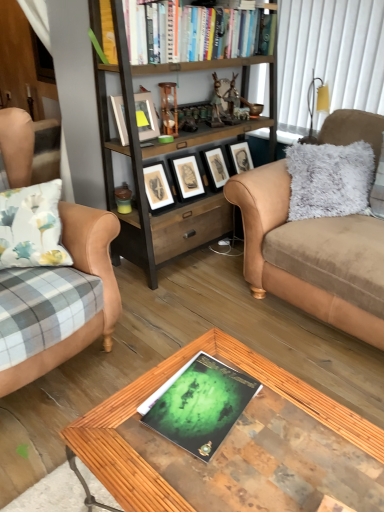
You are a GUI agent. You are given a task and a screenshot of the screen. Output one action in this format:
    pyautogui.click(x=<x>, y=<y>)
    Task: Click on the suede couch at right, acting as the first studio couch starting from the right
    This screenshot has height=512, width=384.
    Given the screenshot: What is the action you would take?
    pyautogui.click(x=311, y=255)

Locate an element on the screen. The height and width of the screenshot is (512, 384). green matte magazine at center is located at coordinates (199, 404).

Describe the element at coordinates (199, 404) in the screenshot. I see `green matte magazine at center` at that location.

Describe the element at coordinates (85, 272) in the screenshot. I see `tan leather couch at left, acting as the 2th studio couch starting from the right` at that location.

At what (x,y) coordinates should I click in order to perform the action: click on wooden glass coffee table at center. Please return your answer as a coordinate pair (x, y). The width and height of the screenshot is (384, 512). Looking at the image, I should click on (235, 446).

What is the approximate width of matte wooden picture frame at upper center, which ranks as the 2th picture frame in right-to-left order?

matte wooden picture frame at upper center, which ranks as the 2th picture frame in right-to-left order, is 3.93 inches wide.

The width and height of the screenshot is (384, 512). Describe the element at coordinates (166, 155) in the screenshot. I see `woodenmaterial/texture bookcase at center` at that location.

In order to click on suede couch at right, acting as the first studio couch starting from the right in this screenshot , I will do `click(311, 255)`.

Is woodenmaterial/texture bookcase at center outside of hardcover books at upper center?

Indeed, woodenmaterial/texture bookcase at center is completely outside hardcover books at upper center.

Between woodenmaterial/texture bookcase at center and hardcover books at upper center, which one has larger size?

woodenmaterial/texture bookcase at center.

Based on the photo, measure the distance between woodenmaterial/texture bookcase at center and hardcover books at upper center.

A distance of 14.29 inches exists between woodenmaterial/texture bookcase at center and hardcover books at upper center.

How many degrees apart are the facing directions of woodenmaterial/texture bookcase at center and hardcover books at upper center?

The angular difference between woodenmaterial/texture bookcase at center and hardcover books at upper center is 0.709 degrees.

Is suede couch at right, acting as the first studio couch starting from the right, oriented towards matte wooden picture frame at upper center, the first picture frame in the left-to-right sequence?

No, suede couch at right, acting as the first studio couch starting from the right, is not turned towards matte wooden picture frame at upper center, the first picture frame in the left-to-right sequence.

Does point (357, 333) appear closer or farther from the camera than point (145, 116)?

Point (357, 333) is closer to the camera than point (145, 116).

From a real-world perspective, is suede couch at right, which appears as the second studio couch when viewed from the left, physically located above or below matte wooden picture frame at upper center, arranged as the first picture frame when viewed from the front?

Clearly, from a real-world perspective, suede couch at right, which appears as the second studio couch when viewed from the left, is below matte wooden picture frame at upper center, arranged as the first picture frame when viewed from the front.

From the image's perspective, does suede couch at right, acting as the first studio couch starting from the right, appear lower than matte wooden picture frame at upper center, arranged as the second picture frame when viewed from the back?

Correct, suede couch at right, acting as the first studio couch starting from the right, appears lower than matte wooden picture frame at upper center, arranged as the second picture frame when viewed from the back, in the image.

Is point (141, 221) closer to camera compared to point (199, 179)?

Yes.

From the image's perspective, is woodenmaterial/texture bookcase at center on top of matte black picture frame at center, which appears as the 2th picture frame when viewed from the front?

Indeed, from the image's perspective, woodenmaterial/texture bookcase at center is shown above matte black picture frame at center, which appears as the 2th picture frame when viewed from the front.

Based on the photo, considering the sizes of objects woodenmaterial/texture bookcase at center and matte black picture frame at center, which appears as the 2th picture frame when viewed from the front, in the image provided, who is shorter, woodenmaterial/texture bookcase at center or matte black picture frame at center, which appears as the 2th picture frame when viewed from the front,?

matte black picture frame at center, which appears as the 2th picture frame when viewed from the front.

Can you tell me how much matte black picture frame at center, which ranks as the 1th picture frame in right-to-left order, and hardcover books at upper center differ in facing direction?

There is a 3.51-degree angle between the facing directions of matte black picture frame at center, which ranks as the 1th picture frame in right-to-left order, and hardcover books at upper center.

You are a GUI agent. You are given a task and a screenshot of the screen. Output one action in this format:
    pyautogui.click(x=<x>, y=<y>)
    Task: Click on the 2nd picture frame positioned below the hardcover books at upper center (from a real-world perspective)
    This screenshot has width=384, height=512.
    Given the screenshot: What is the action you would take?
    pyautogui.click(x=187, y=177)

From the image's perspective, is matte black picture frame at center, which ranks as the 1th picture frame in right-to-left order, under hardcover books at upper center?

Yes, from the image's perspective, matte black picture frame at center, which ranks as the 1th picture frame in right-to-left order, is beneath hardcover books at upper center.

Is green matte magazine at center taller than matte wooden picture frame at upper center, arranged as the first picture frame when viewed from the front?

No, green matte magazine at center is not taller than matte wooden picture frame at upper center, arranged as the first picture frame when viewed from the front.

The image size is (384, 512). In order to click on magazine that appears on the right of matte wooden picture frame at upper center, arranged as the second picture frame when viewed from the back in this screenshot , I will do (x=199, y=404).

Is green matte magazine at center outside of matte wooden picture frame at upper center, arranged as the first picture frame when viewed from the front?

Absolutely, green matte magazine at center is external to matte wooden picture frame at upper center, arranged as the first picture frame when viewed from the front.

Can you confirm if wooden glass coffee table at center is thinner than matte wooden picture frame at upper center, arranged as the first picture frame when viewed from the front?

Incorrect, the width of wooden glass coffee table at center is not less than that of matte wooden picture frame at upper center, arranged as the first picture frame when viewed from the front.

Who is shorter, wooden glass coffee table at center or matte wooden picture frame at upper center, which ranks as the 2th picture frame in right-to-left order?

matte wooden picture frame at upper center, which ranks as the 2th picture frame in right-to-left order, is shorter.

From a real-world perspective, does wooden glass coffee table at center stand above matte wooden picture frame at upper center, the first picture frame in the left-to-right sequence?

No, from a real-world perspective, wooden glass coffee table at center is not on top of matte wooden picture frame at upper center, the first picture frame in the left-to-right sequence.

Considering the relative sizes of tan leather couch at left, acting as the 2th studio couch starting from the right, and matte wooden picture frame at upper center, which ranks as the 2th picture frame in right-to-left order, in the image provided, is tan leather couch at left, acting as the 2th studio couch starting from the right, shorter than matte wooden picture frame at upper center, which ranks as the 2th picture frame in right-to-left order,?

Incorrect, the height of tan leather couch at left, acting as the 2th studio couch starting from the right, does not fall short of that of matte wooden picture frame at upper center, which ranks as the 2th picture frame in right-to-left order.

Is tan leather couch at left, which is counted as the 1th studio couch, starting from the left, to the left or to the right of matte wooden picture frame at upper center, the first picture frame in the left-to-right sequence, in the image?

tan leather couch at left, which is counted as the 1th studio couch, starting from the left, is to the left of matte wooden picture frame at upper center, the first picture frame in the left-to-right sequence.

Could you tell me if tan leather couch at left, acting as the 2th studio couch starting from the right, is facing matte wooden picture frame at upper center, arranged as the first picture frame when viewed from the front?

No.

This screenshot has height=512, width=384. Find the location of `book above the woodenmaterial/texture bookcase at center (from the image's perspective)`. book above the woodenmaterial/texture bookcase at center (from the image's perspective) is located at coordinates (210, 35).

From the image's perspective, starting from the matte wooden picture frame at upper center, arranged as the second picture frame when viewed from the back, which studio couch is the 1st one below? Please provide its 2D coordinates.

[(311, 255)]

Looking at the image, which one is located further to matte black picture frame at center, which ranks as the 1th picture frame in right-to-left order, woodenmaterial/texture bookcase at center or green matte magazine at center?

green matte magazine at center is positioned further to the anchor matte black picture frame at center, which ranks as the 1th picture frame in right-to-left order.

From the image, which object appears to be nearer to matte black picture frame at center, which appears as the 2th picture frame when viewed from the front, hardcover books at upper center or suede couch at right, which appears as the second studio couch when viewed from the left?

hardcover books at upper center is closer to matte black picture frame at center, which appears as the 2th picture frame when viewed from the front.

Based on their spatial positions, is wooden glass coffee table at center or tan leather couch at left, which is counted as the 1th studio couch, starting from the left, closer to suede couch at right, acting as the first studio couch starting from the right?

Based on the image, tan leather couch at left, which is counted as the 1th studio couch, starting from the left, appears to be nearer to suede couch at right, acting as the first studio couch starting from the right.

Looking at the image, which one is located closer to woodenmaterial/texture bookcase at center, green matte magazine at center or wooden glass coffee table at center?

wooden glass coffee table at center is closer to woodenmaterial/texture bookcase at center.

When comparing their distances from hardcover books at upper center, does woodenmaterial/texture bookcase at center or tan leather couch at left, acting as the 2th studio couch starting from the right, seem closer?

Based on the image, woodenmaterial/texture bookcase at center appears to be nearer to hardcover books at upper center.

From the image, which object appears to be nearer to suede couch at right, which appears as the second studio couch when viewed from the left, tan leather couch at left, which is counted as the 1th studio couch, starting from the left, or wooden glass coffee table at center?

Based on the image, tan leather couch at left, which is counted as the 1th studio couch, starting from the left, appears to be nearer to suede couch at right, which appears as the second studio couch when viewed from the left.

From the image, which object appears to be nearer to tan leather couch at left, which is counted as the 1th studio couch, starting from the left, matte black picture frame at center, placed as the second picture frame when sorted from left to right, or suede couch at right, acting as the first studio couch starting from the right?

Based on the image, suede couch at right, acting as the first studio couch starting from the right, appears to be nearer to tan leather couch at left, which is counted as the 1th studio couch, starting from the left.

When comparing their distances from hardcover books at upper center, does woodenmaterial/texture bookcase at center or wooden glass coffee table at center seem closer?

woodenmaterial/texture bookcase at center is positioned closer to the anchor hardcover books at upper center.

Identify the location of bookcase located between wooden glass coffee table at center and matte black picture frame at center, which ranks as the 1th picture frame in right-to-left order, in the depth direction. point(166,155).

Find the location of a particular element. picture frame between woodenmaterial/texture bookcase at center and matte black picture frame at center, which ranks as the 1th picture frame in right-to-left order, along the z-axis is located at coordinates (146, 117).

You are a GUI agent. You are given a task and a screenshot of the screen. Output one action in this format:
    pyautogui.click(x=<x>, y=<y>)
    Task: Click on the magazine that lies between hardcover books at upper center and wooden glass coffee table at center from top to bottom
    The image size is (384, 512).
    Given the screenshot: What is the action you would take?
    pyautogui.click(x=199, y=404)

At what (x,y) coordinates should I click in order to perform the action: click on bookcase between green matte magazine at center and matte black picture frame at center, which appears as the 2th picture frame when viewed from the front, along the z-axis. Please return your answer as a coordinate pair (x, y). The height and width of the screenshot is (512, 384). Looking at the image, I should click on (166, 155).